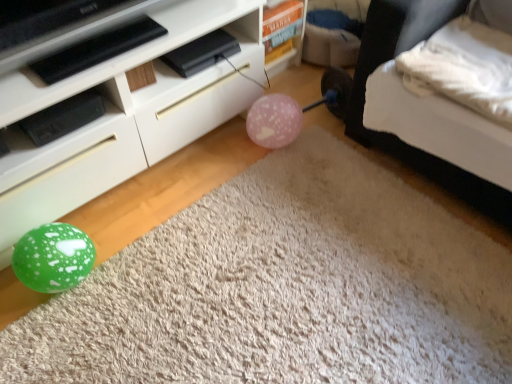
You are a GUI agent. You are given a task and a screenshot of the screen. Output one action in this format:
    pyautogui.click(x=<x>, y=<y>)
    Task: Click on the free location in front of pink matte balloon at center
    
    Given the screenshot: What is the action you would take?
    pyautogui.click(x=272, y=168)